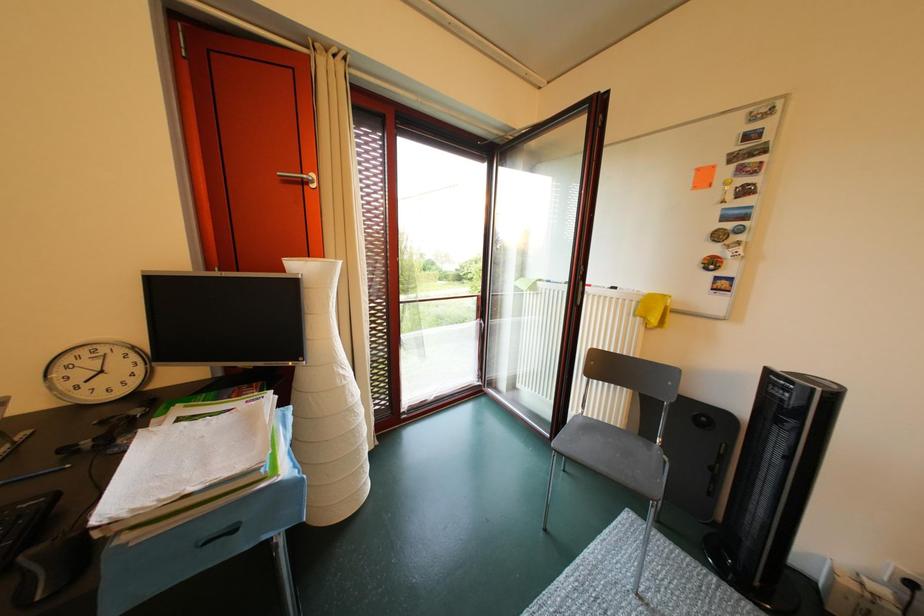
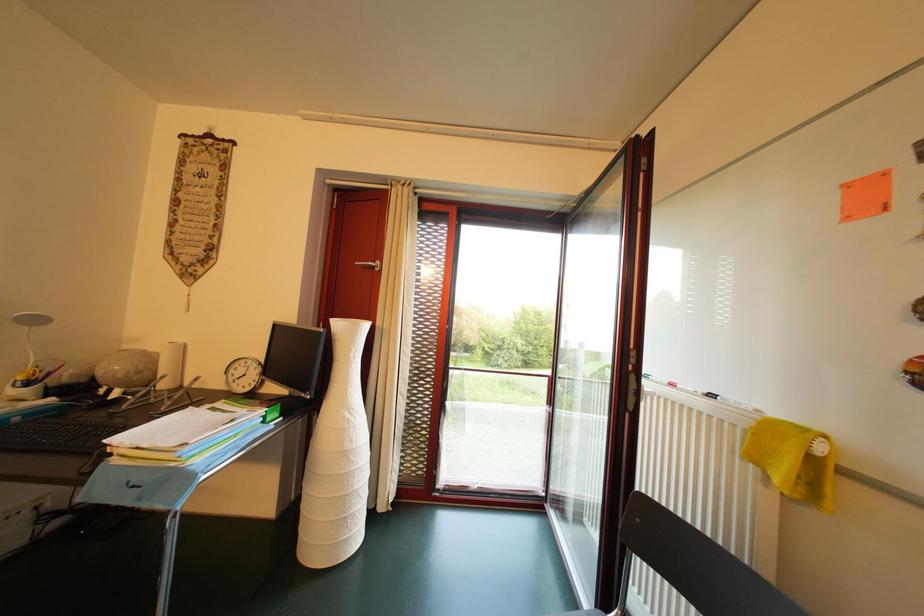
Question: Based on the continuous images, in which direction is the camera rotating? Reply with the corresponding letter.

Choices:
 (A) Left
 (B) Right
 (C) Up
 (D) Down

Answer: (A)